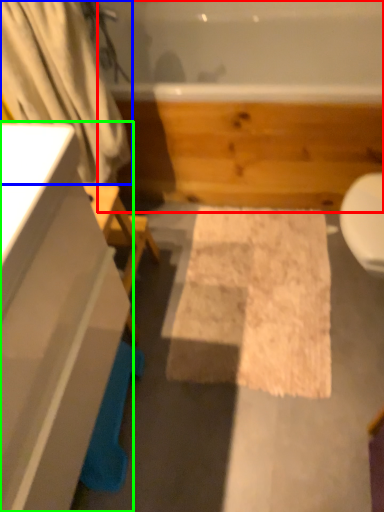
Question: Estimate the real-world distances between objects in this image. Which object is closer to jacuzzi (highlighted by a red box), shower curtain (highlighted by a blue box) or bathroom cabinet (highlighted by a green box)?

Choices:
 (A) shower curtain
 (B) bathroom cabinet

Answer: (A)